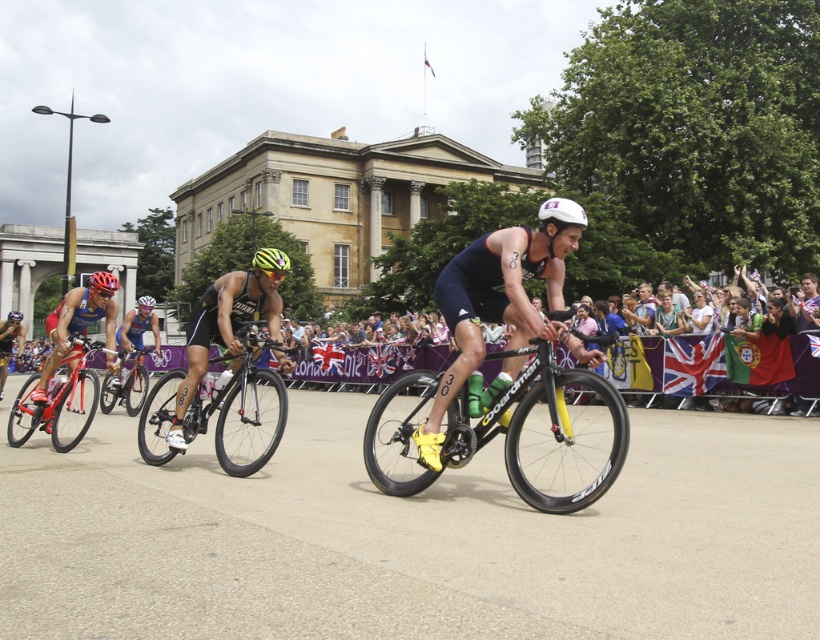
Is black matte bicycle at center behind yellow matte helmet at center?

That is False.

I want to click on black matte bicycle at center, so click(509, 433).

Locate an element on the screen. black matte bicycle at center is located at coordinates (509, 433).

Is black matte bicycle at center shorter than matte yellow helmet at center?

No, black matte bicycle at center is not shorter than matte yellow helmet at center.

Between black matte bicycle at center and matte yellow helmet at center, which one appears on the left side from the viewer's perspective?

Positioned to the left is matte yellow helmet at center.

Does point (394, 493) come behind point (112, 289)?

That is False.

You are a GUI agent. You are given a task and a screenshot of the screen. Output one action in this format:
    pyautogui.click(x=<x>, y=<y>)
    Task: Click on the black matte bicycle at center
    The height and width of the screenshot is (640, 820).
    Given the screenshot: What is the action you would take?
    pyautogui.click(x=509, y=433)

Does shiny silver bicycle at center lie in front of matte yellow helmet at center?

No, it is not.

Which is more to the left, shiny silver bicycle at center or matte yellow helmet at center?

Positioned to the left is matte yellow helmet at center.

What do you see at coordinates (126, 385) in the screenshot? The image size is (820, 640). I see `shiny silver bicycle at center` at bounding box center [126, 385].

Identify the location of shiny silver bicycle at center. (126, 385).